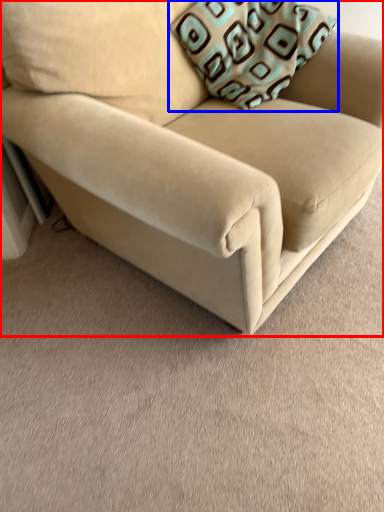
Question: Which object appears farthest to the camera in this image, studio couch (highlighted by a red box) or throw pillow (highlighted by a blue box)?

Choices:
 (A) studio couch
 (B) throw pillow

Answer: (B)